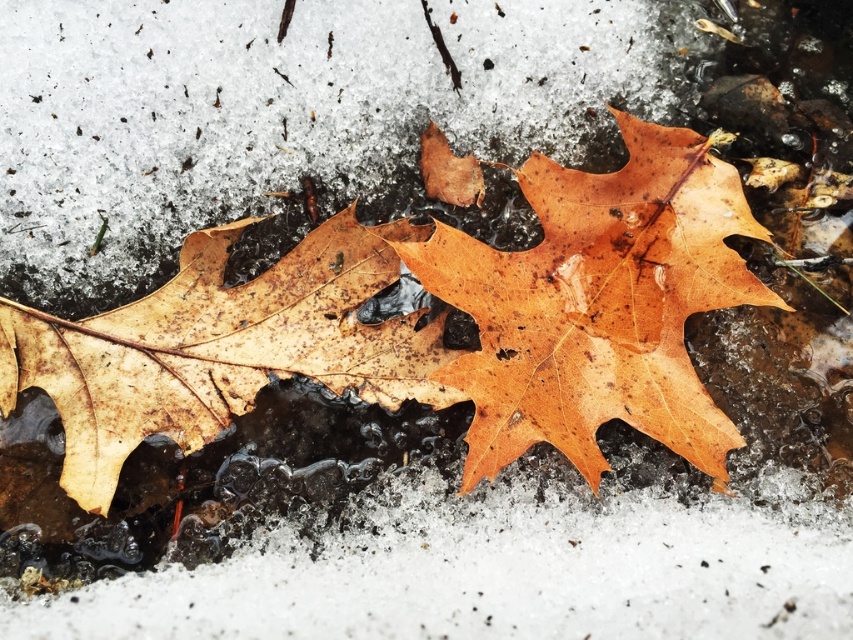
In the scene shown: You are an artist trying to sketch the scene. You want to draw the shiny brown leaf at center and the brown matte leaf at left accurately. Which leaf should you draw first to account for their positions?

The brown matte leaf at left should be drawn first because it is behind the shiny brown leaf at center, so you need to layer it underneath.

You are standing at the camera position and want to pick up an object located at point (490, 417). Can you reach it without moving your feet?

The distance between you and the point (490, 417) is 1.19 meters. If your arm can reach at least 1.19 meters, you can pick it up without moving your feet.